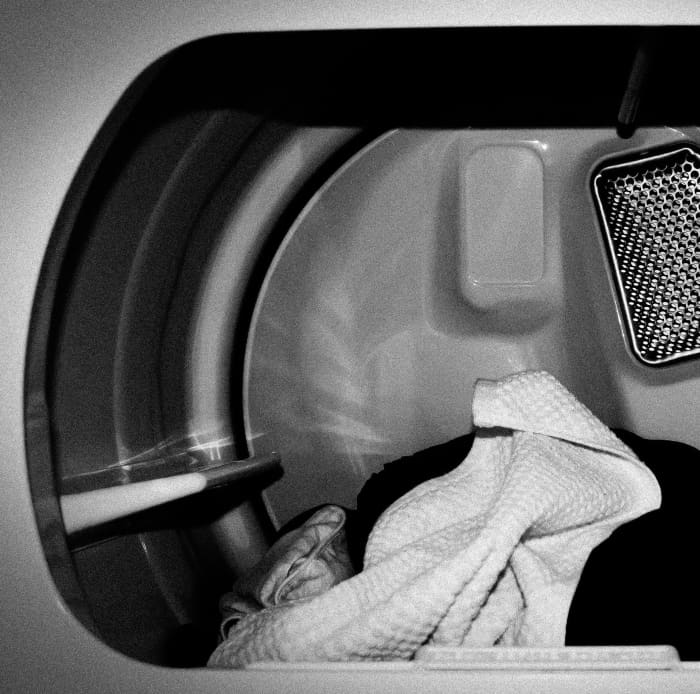
Identify the location of dryer lint catcher. (528, 661).